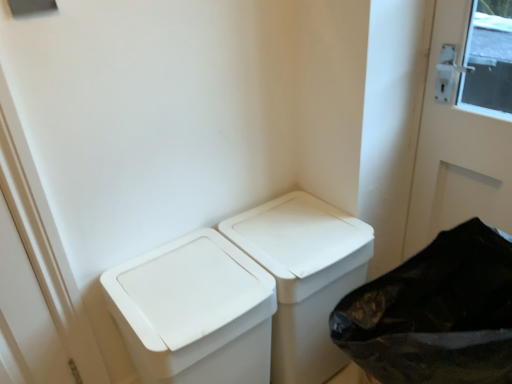
Question: Does white plastic waste container at center, which ranks as the first waste container in right-to-left order, have a greater height compared to white plastic waste container at center, the second waste container viewed from the right?

Choices:
 (A) yes
 (B) no

Answer: (A)

Question: Is white plastic waste container at center, which is the 2th waste container from left to right, thinner than white plastic waste container at center, the second waste container viewed from the right?

Choices:
 (A) no
 (B) yes

Answer: (B)

Question: Is white plastic waste container at center, which is the 2th waste container from left to right, outside of white plastic waste container at center, the first waste container positioned from the left?

Choices:
 (A) no
 (B) yes

Answer: (B)

Question: From a real-world perspective, is white plastic waste container at center, which ranks as the first waste container in right-to-left order, located beneath white plastic waste container at center, the second waste container viewed from the right?

Choices:
 (A) no
 (B) yes

Answer: (B)

Question: Would you say white plastic waste container at center, the first waste container positioned from the left, is part of white plastic waste container at center, which ranks as the first waste container in right-to-left order,'s contents?

Choices:
 (A) no
 (B) yes

Answer: (A)

Question: From a real-world perspective, is white plastic waste container at center, which is the 2th waste container from left to right, over white plastic waste container at center, the first waste container positioned from the left?

Choices:
 (A) yes
 (B) no

Answer: (B)

Question: Is white plastic waste container at center, the first waste container positioned from the left, oriented away from white plastic waste container at center, which ranks as the first waste container in right-to-left order?

Choices:
 (A) no
 (B) yes

Answer: (A)

Question: Considering the relative sizes of white plastic waste container at center, the second waste container viewed from the right, and white plastic waste container at center, which ranks as the first waste container in right-to-left order, in the image provided, is white plastic waste container at center, the second waste container viewed from the right, shorter than white plastic waste container at center, which ranks as the first waste container in right-to-left order,?

Choices:
 (A) no
 (B) yes

Answer: (B)

Question: From a real-world perspective, is white plastic waste container at center, the first waste container positioned from the left, positioned over white plastic waste container at center, which is the 2th waste container from left to right, based on gravity?

Choices:
 (A) yes
 (B) no

Answer: (A)

Question: Is white plastic waste container at center, the first waste container positioned from the left, far away from white plastic waste container at center, which is the 2th waste container from left to right?

Choices:
 (A) yes
 (B) no

Answer: (B)

Question: Considering the relative sizes of white plastic waste container at center, the first waste container positioned from the left, and white plastic waste container at center, which ranks as the first waste container in right-to-left order, in the image provided, is white plastic waste container at center, the first waste container positioned from the left, smaller than white plastic waste container at center, which ranks as the first waste container in right-to-left order,?

Choices:
 (A) no
 (B) yes

Answer: (A)

Question: Does white plastic waste container at center, the second waste container viewed from the right, turn towards white plastic waste container at center, which ranks as the first waste container in right-to-left order?

Choices:
 (A) yes
 (B) no

Answer: (B)

Question: From a real-world perspective, is white plastic waste container at center, the second waste container viewed from the right, positioned under white plastic recycling bin at lower right based on gravity?

Choices:
 (A) no
 (B) yes

Answer: (B)